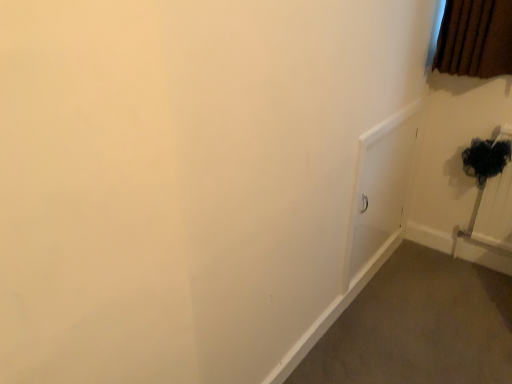
Describe the element at coordinates (381, 188) in the screenshot. I see `white glossy screen door at right` at that location.

Identify the location of white glossy screen door at right. (381, 188).

You are a GUI agent. You are given a task and a screenshot of the screen. Output one action in this format:
    pyautogui.click(x=<x>, y=<y>)
    Task: Click on the white glossy screen door at right
    
    Given the screenshot: What is the action you would take?
    pyautogui.click(x=381, y=188)